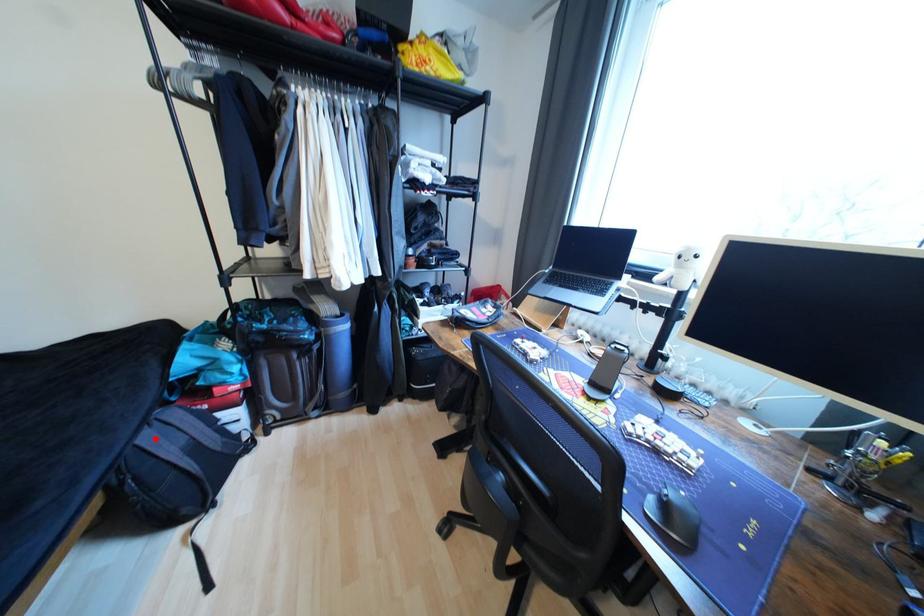
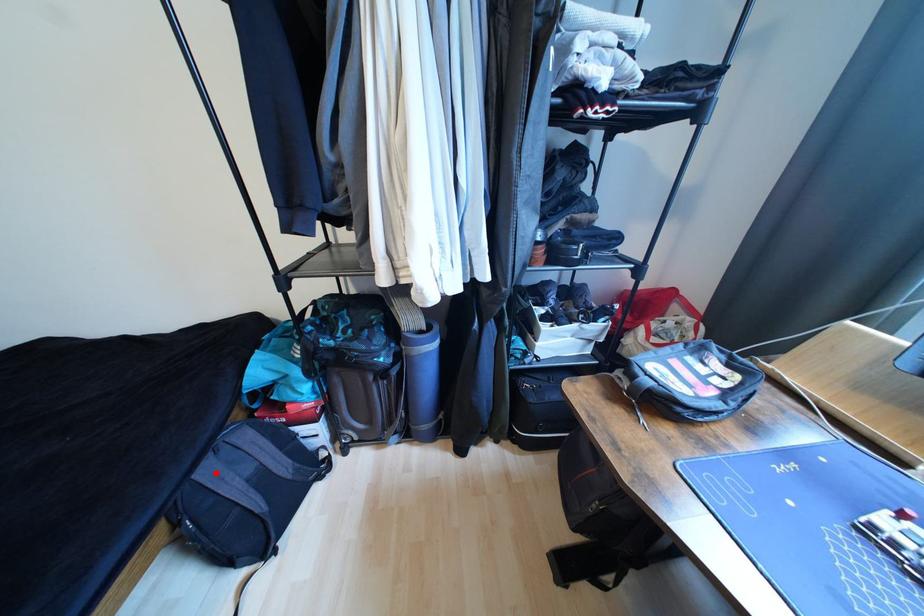
I am providing you with two images of the same scene from different viewpoints. A red point is marked on the first image and another point is marked on the second image. Are the points marked in image1 and image2 representing the same 3D position?

Yes